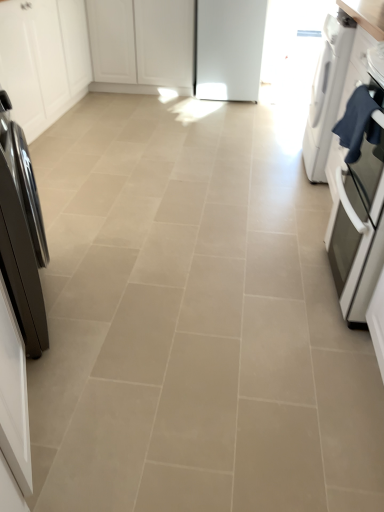
Identify the location of blank space to the left of matte stainless steel oven at right. Image resolution: width=384 pixels, height=512 pixels. (266, 284).